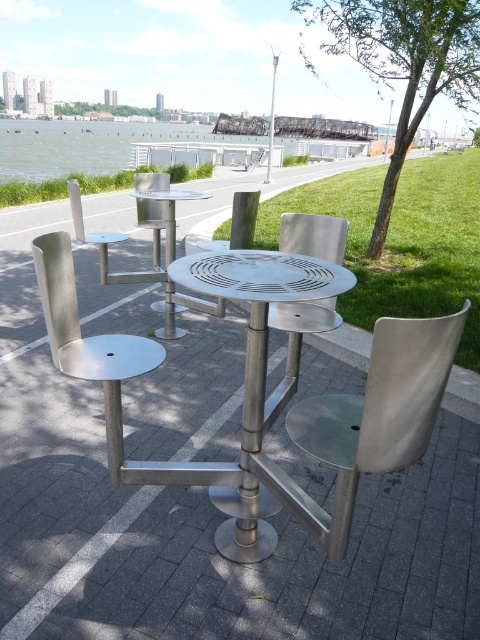
Can you confirm if silver metallic chair at center is positioned below metallic silver chair at center?

Yes.

Does point (412, 392) come farther from viewer compared to point (301, 323)?

No, it is not.

Between point (400, 352) and point (303, 227), which one is positioned behind?

The point (303, 227) is behind.

Locate an element on the screen. This screenshot has width=480, height=640. silver metallic chair at center is located at coordinates click(380, 410).

How distant is metallic silver chair at center from metallic pole at upper center?

metallic silver chair at center is 35.47 meters from metallic pole at upper center.

Which is above, metallic silver chair at center or metallic pole at upper center?

metallic pole at upper center

Does point (274, 307) come in front of point (384, 157)?

That is True.

Where is `metallic silver chair at center`? metallic silver chair at center is located at coordinates (296, 342).

Does polished silver chair at left lie in front of polished stainless steel chair at center?

Yes, polished silver chair at left is in front of polished stainless steel chair at center.

Measure the distance between polished silver chair at left and camera.

The distance of polished silver chair at left from camera is 1.79 meters.

Measure the distance between point [132,481] and camera.

The distance of point [132,481] from camera is 6.59 feet.

In order to click on polished silver chair at left in this screenshot , I will do `click(90, 344)`.